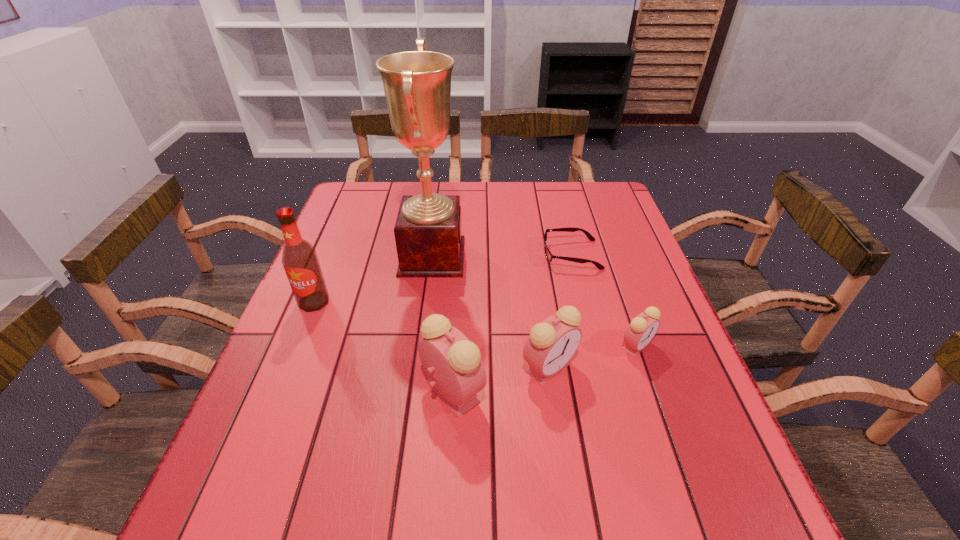
This screenshot has width=960, height=540. In order to click on vacant space at the far edge in this screenshot , I will do `click(564, 208)`.

The image size is (960, 540). In the image, there is a desktop. Identify the location of free space at the near edge. (625, 437).

Where is `vacant point at the left edge`? The image size is (960, 540). vacant point at the left edge is located at coordinates coord(344,258).

I want to click on vacant space at the right edge of the desktop, so click(x=611, y=238).

In the image, there is a desktop. Where is `blank space at the far left corner`? Image resolution: width=960 pixels, height=540 pixels. blank space at the far left corner is located at coordinates (393, 184).

In the image, there is a desktop. At what (x,y) coordinates should I click in order to perform the action: click on vacant region at the far right corner. Please return your answer as a coordinate pair (x, y). The image size is (960, 540). Looking at the image, I should click on (608, 204).

I want to click on free space between the shortest object and the beer bottle, so click(x=443, y=278).

Where is `free spot between the leftmost alarm clock and the second shortest alarm clock`? The width and height of the screenshot is (960, 540). free spot between the leftmost alarm clock and the second shortest alarm clock is located at coordinates (501, 380).

This screenshot has height=540, width=960. What are the coordinates of `vacant area that lies between the leftmost alarm clock and the shortest object` in the screenshot? It's located at (513, 323).

Locate an element on the screen. This screenshot has width=960, height=540. free space that is in between the second shortest object and the second tallest object is located at coordinates (475, 324).